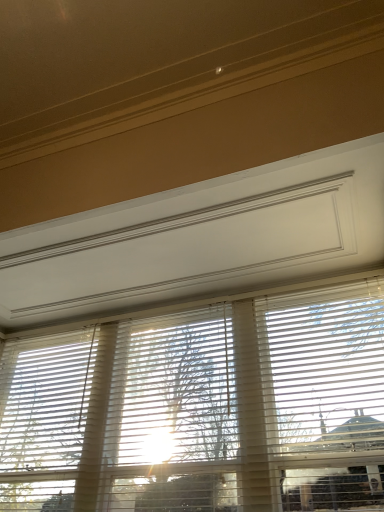
Question: Is white matte blinds at right positioned before white matte blinds at center?

Choices:
 (A) no
 (B) yes

Answer: (A)

Question: From a real-world perspective, is white matte blinds at right beneath white matte blinds at center?

Choices:
 (A) yes
 (B) no

Answer: (A)

Question: Is white matte blinds at right bigger than white matte blinds at center?

Choices:
 (A) yes
 (B) no

Answer: (B)

Question: Is white matte blinds at right completely or partially outside of white matte blinds at center?

Choices:
 (A) yes
 (B) no

Answer: (B)

Question: Is white matte blinds at right to the left of white matte blinds at center from the viewer's perspective?

Choices:
 (A) yes
 (B) no

Answer: (B)

Question: From the image's perspective, is white matte blinds at right located beneath white matte blinds at center?

Choices:
 (A) yes
 (B) no

Answer: (B)

Question: From a real-world perspective, is white matte blinds at center located higher than white matte blinds at right?

Choices:
 (A) no
 (B) yes

Answer: (B)

Question: Is white matte blinds at center turned away from white matte blinds at right?

Choices:
 (A) no
 (B) yes

Answer: (B)

Question: Is white matte blinds at center with white matte blinds at right?

Choices:
 (A) no
 (B) yes

Answer: (A)

Question: From the image's perspective, does white matte blinds at center appear lower than white matte blinds at right?

Choices:
 (A) no
 (B) yes

Answer: (B)

Question: Can you confirm if white matte blinds at center is positioned to the right of white matte blinds at right?

Choices:
 (A) yes
 (B) no

Answer: (B)

Question: Does white matte blinds at center have a lesser height compared to white matte blinds at right?

Choices:
 (A) yes
 (B) no

Answer: (B)

Question: Can you confirm if white matte blinds at center is wider than translucent wood tree at center?

Choices:
 (A) no
 (B) yes

Answer: (B)